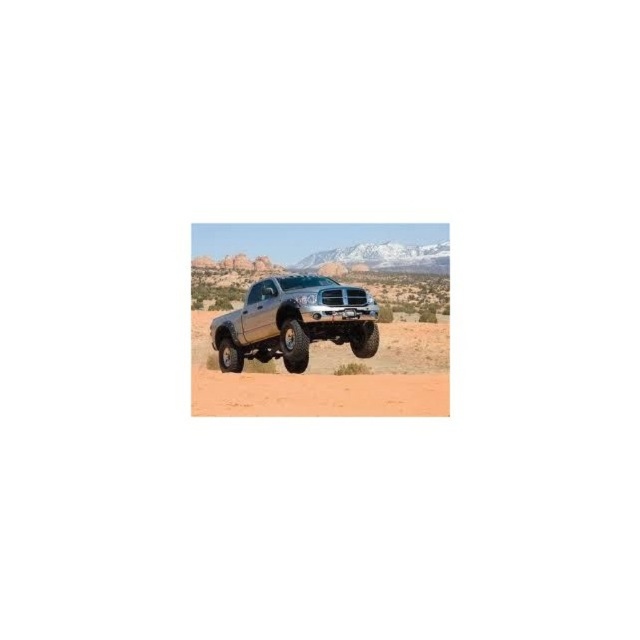
What are the coordinates of the sandy brown dirt at center in the image?

The coordinates of the sandy brown dirt at center are at point (330, 378).

You are a driver trying to park the silver metallic truck at center on the sandy brown dirt at center. Is the truck currently above or below the dirt?

The sandy brown dirt at center is below the silver metallic truck at center, so the truck is currently above the dirt.

You are standing at the camera position and want to reach the point marked as point [436,349]. If your walking speed is 1.5 meters per second, how long will it take you to reach that point?

The point [436,349] is 32.94 meters away from the camera. At a walking speed of 1.5 meters per second, it will take approximately 21.96 seconds to reach the point.